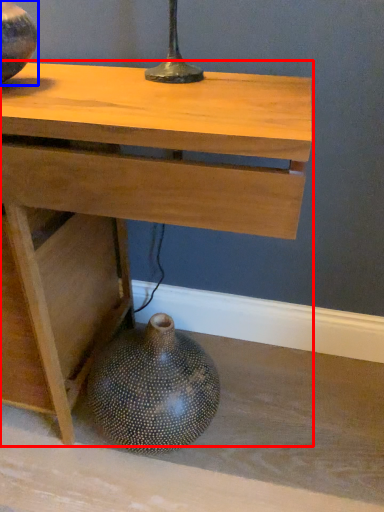
Question: Which point is closer to the camera, table (highlighted by a red box) or vase (highlighted by a blue box)?

Choices:
 (A) table
 (B) vase

Answer: (A)